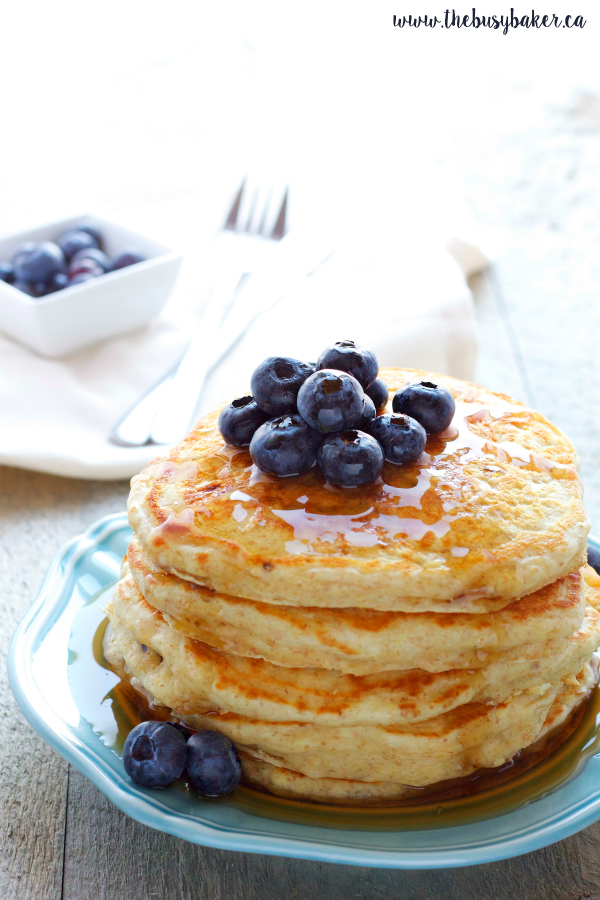
I want to click on fork, so click(x=237, y=250).